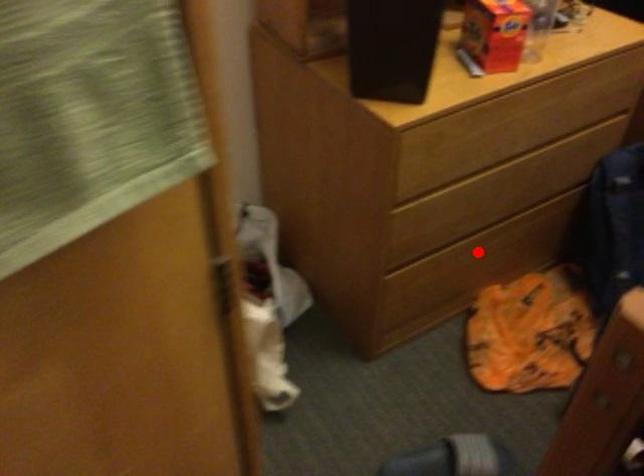
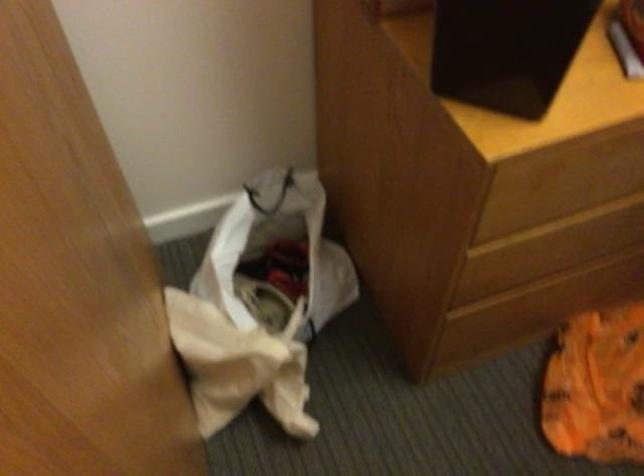
Question: I am providing you with two images of the same scene from different viewpoints. Given a red point in image1, look at the same physical point in image2. Is it:

Choices:
 (A) Closer to the viewpoint
 (B) Farther from the viewpoint

Answer: (A)